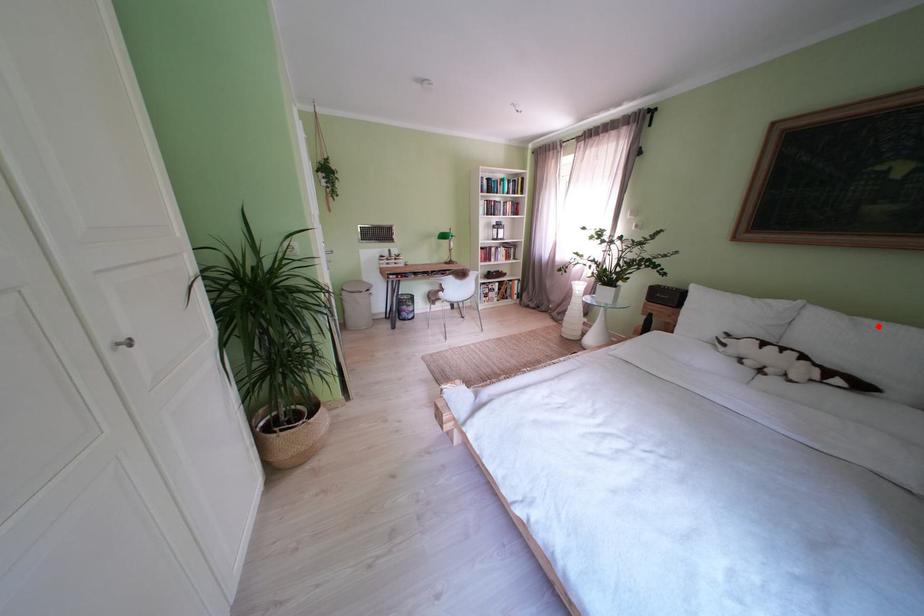
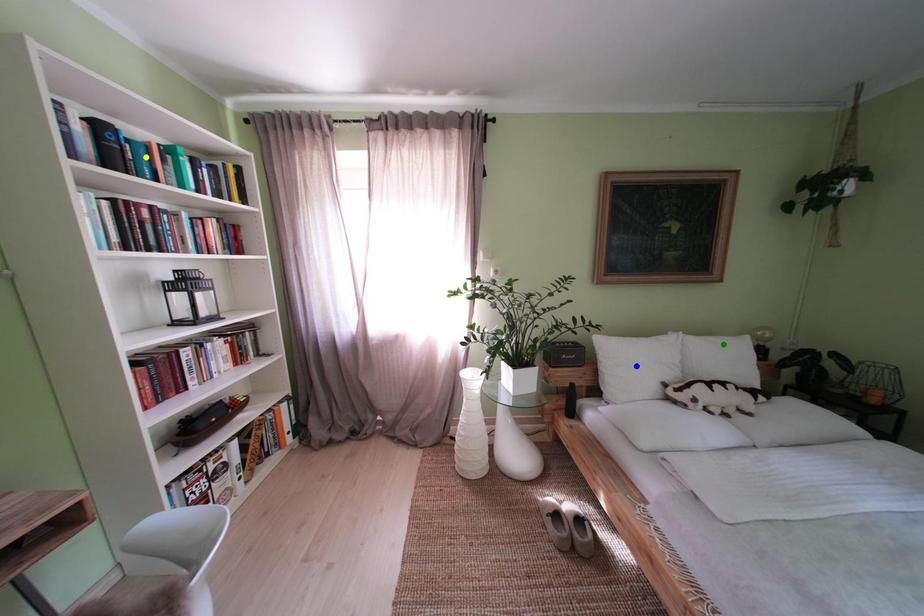
Question: I am providing you with two images of the same scene from different viewpoints. A red point is marked on the first image. You are given multiple points on the second image. Which point in image 2 represents the same 3d spot as the red point in image 1?

Choices:
 (A) blue point
 (B) yellow point
 (C) green point

Answer: (C)